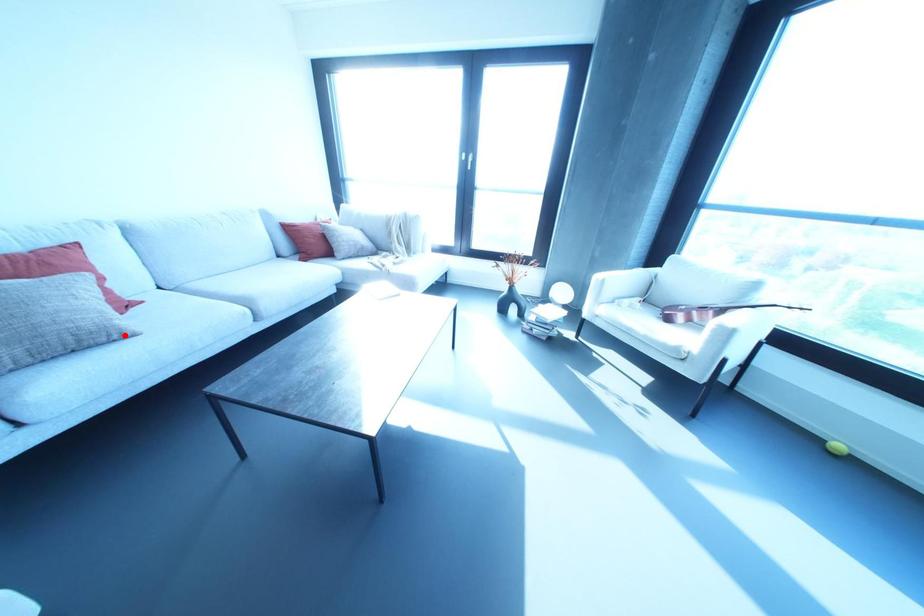
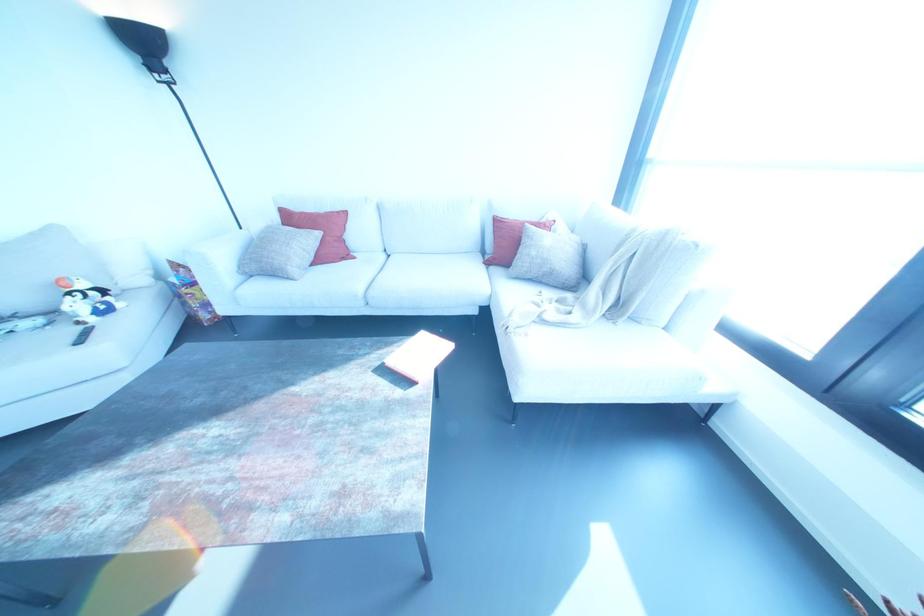
In the second image, find the point that corresponds to the highlighted location in the first image.

(287, 277)